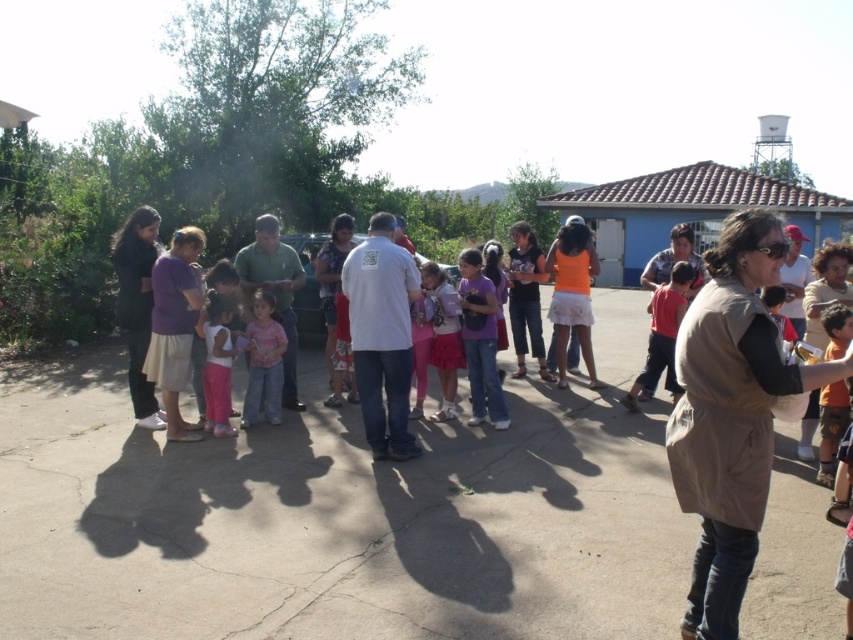
Is purple cotton shirt at left bigger than orange matte skirt at center?

No.

This screenshot has width=853, height=640. What are the coordinates of `purple cotton shirt at left` in the screenshot? It's located at [x=175, y=324].

Which is below, red cotton shirt at center or pink cotton shirt at center?

Positioned lower is pink cotton shirt at center.

Does red cotton shirt at center have a lesser height compared to pink cotton shirt at center?

In fact, red cotton shirt at center may be taller than pink cotton shirt at center.

Describe the element at coordinates (663, 333) in the screenshot. The image size is (853, 640). I see `red cotton shirt at center` at that location.

Find the location of `red cotton shirt at center`. red cotton shirt at center is located at coordinates (663, 333).

Measure the distance between black fabric jacket at left and camera.

They are 6.66 meters apart.

Between point (164, 420) and point (253, 368), which one is positioned in front?

Point (164, 420) is more forward.

Is point (128, 218) positioned after point (250, 408)?

Yes, it is.

At what (x,y) coordinates should I click in order to perform the action: click on black fabric jacket at left. Please return your answer as a coordinate pair (x, y). Looking at the image, I should click on (137, 305).